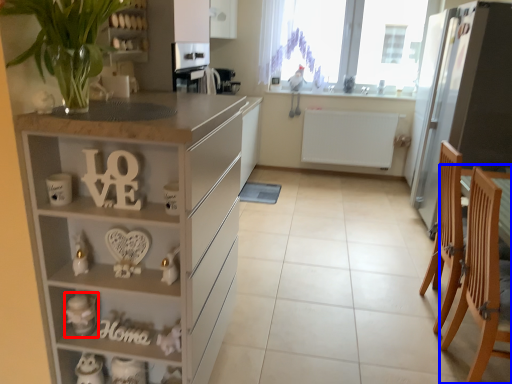
Question: Which point is further to the camera, toy (highlighted by a red box) or armchair (highlighted by a blue box)?

Choices:
 (A) toy
 (B) armchair

Answer: (A)